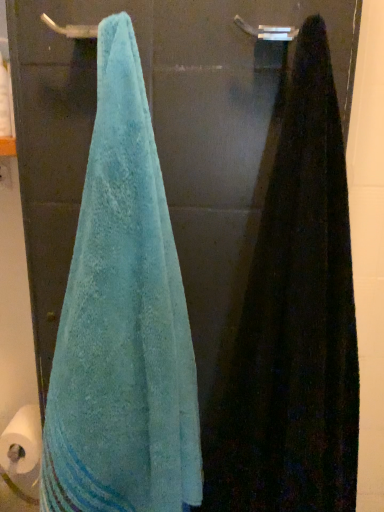
Question: Would you say teal terry cloth towel at left, the 1th towel in the left-to-right sequence, is part of silver metallic towel bar at upper center's contents?

Choices:
 (A) no
 (B) yes

Answer: (A)

Question: Could you tell me if silver metallic towel bar at upper center is facing teal terry cloth towel at left, the 2th towel positioned from the right?

Choices:
 (A) no
 (B) yes

Answer: (A)

Question: From a real-world perspective, is silver metallic towel bar at upper center over teal terry cloth towel at left, the 2th towel positioned from the right?

Choices:
 (A) yes
 (B) no

Answer: (A)

Question: Is silver metallic towel bar at upper center next to teal terry cloth towel at left, the 1th towel in the left-to-right sequence, and touching it?

Choices:
 (A) yes
 (B) no

Answer: (B)

Question: Does silver metallic towel bar at upper center lie behind teal terry cloth towel at left, the 2th towel positioned from the right?

Choices:
 (A) no
 (B) yes

Answer: (B)

Question: From the image's perspective, would you say silver metallic towel bar at upper center is positioned over teal terry cloth towel at left, the 1th towel in the left-to-right sequence?

Choices:
 (A) no
 (B) yes

Answer: (B)

Question: Is silver metallic towel bar at upper center taller than black fuzzy towel at right, marked as the 1th towel in a right-to-left arrangement?

Choices:
 (A) no
 (B) yes

Answer: (A)

Question: Can you confirm if silver metallic towel bar at upper center is shorter than black fuzzy towel at right, marked as the 1th towel in a right-to-left arrangement?

Choices:
 (A) yes
 (B) no

Answer: (A)

Question: Considering the relative sizes of silver metallic towel bar at upper center and black fuzzy towel at right, the second towel viewed from the left, in the image provided, is silver metallic towel bar at upper center thinner than black fuzzy towel at right, the second towel viewed from the left,?

Choices:
 (A) yes
 (B) no

Answer: (A)

Question: Is silver metallic towel bar at upper center not near black fuzzy towel at right, the second towel viewed from the left?

Choices:
 (A) yes
 (B) no

Answer: (B)

Question: Is silver metallic towel bar at upper center in front of black fuzzy towel at right, marked as the 1th towel in a right-to-left arrangement?

Choices:
 (A) yes
 (B) no

Answer: (B)

Question: Does silver metallic towel bar at upper center have a smaller size compared to black fuzzy towel at right, the second towel viewed from the left?

Choices:
 (A) no
 (B) yes

Answer: (B)

Question: Does black fuzzy towel at right, the second towel viewed from the left, come behind silver metallic towel bar at upper center?

Choices:
 (A) yes
 (B) no

Answer: (B)